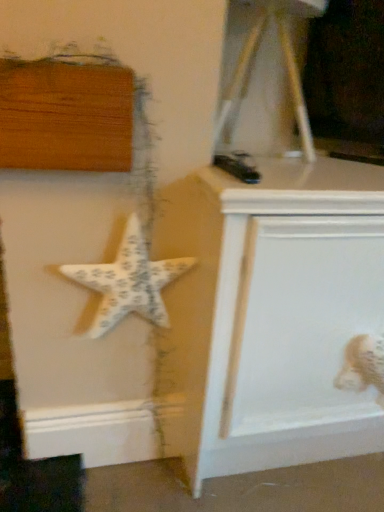
Question: Is white textured starfish at center-left taller than white painted wood vanity at center?

Choices:
 (A) no
 (B) yes

Answer: (A)

Question: From a real-world perspective, is white textured starfish at center-left positioned under white painted wood vanity at center based on gravity?

Choices:
 (A) yes
 (B) no

Answer: (B)

Question: Does white textured starfish at center-left have a larger size compared to white painted wood vanity at center?

Choices:
 (A) yes
 (B) no

Answer: (B)

Question: Would you say white textured starfish at center-left is outside white painted wood vanity at center?

Choices:
 (A) no
 (B) yes

Answer: (B)

Question: Is white textured starfish at center-left further to the viewer compared to white painted wood vanity at center?

Choices:
 (A) yes
 (B) no

Answer: (A)

Question: Looking at the image, does white fabric toy at lower right seem bigger or smaller compared to white textured starfish at center-left?

Choices:
 (A) big
 (B) small

Answer: (B)

Question: Is point (379, 382) closer or farther from the camera than point (162, 275)?

Choices:
 (A) closer
 (B) farther

Answer: (B)

Question: Considering the positions of white fabric toy at lower right and white textured starfish at center-left in the image, is white fabric toy at lower right wider or thinner than white textured starfish at center-left?

Choices:
 (A) wide
 (B) thin

Answer: (B)

Question: Relative to white textured starfish at center-left, is white fabric toy at lower right in front or behind?

Choices:
 (A) behind
 (B) front

Answer: (A)

Question: Looking at their shapes, would you say white textured starfish at center-left is wider or thinner than white fabric toy at lower right?

Choices:
 (A) thin
 (B) wide

Answer: (B)

Question: From the image's perspective, is white textured starfish at center-left positioned above or below white fabric toy at lower right?

Choices:
 (A) below
 (B) above

Answer: (B)

Question: Considering the positions of white textured starfish at center-left and white fabric toy at lower right in the image, is white textured starfish at center-left bigger or smaller than white fabric toy at lower right?

Choices:
 (A) big
 (B) small

Answer: (A)

Question: Based on their positions, is white textured starfish at center-left located to the left or right of white fabric toy at lower right?

Choices:
 (A) right
 (B) left

Answer: (B)

Question: From the image's perspective, is white fabric toy at lower right located above or below white painted wood vanity at center?

Choices:
 (A) above
 (B) below

Answer: (B)

Question: In terms of size, does white fabric toy at lower right appear bigger or smaller than white painted wood vanity at center?

Choices:
 (A) big
 (B) small

Answer: (B)